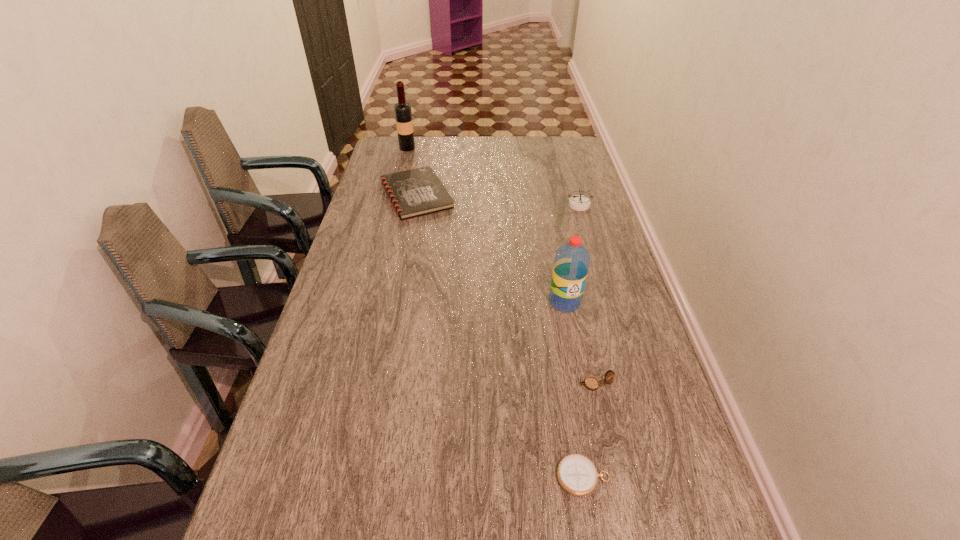
Locate an element on the screen. compass that stands as the second closest to the notebook is located at coordinates (591, 383).

This screenshot has width=960, height=540. What are the coordinates of `blank area in the image that satisfies the following two spatial constraints: 1. on the face of the third shortest object; 2. on the front side of the shortest compass` in the screenshot? It's located at (614, 477).

Image resolution: width=960 pixels, height=540 pixels. In order to click on free space that satisfies the following two spatial constraints: 1. on the front side of the wine bottle; 2. on the right side of the shortest object in this screenshot , I will do `click(323, 477)`.

Locate an element on the screen. The image size is (960, 540). vacant space that satisfies the following two spatial constraints: 1. on the front side of the farthest compass; 2. on the face of the fifth farthest object is located at coordinates (632, 384).